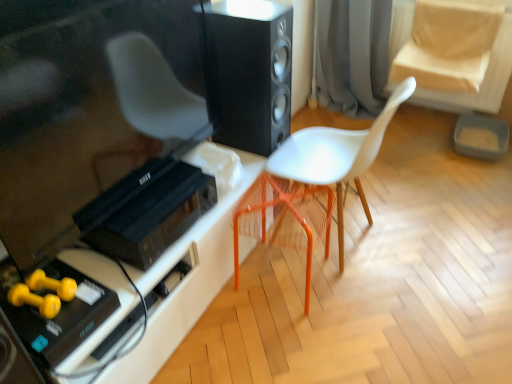
In order to click on free point in front of orange plastic swivel chair at center in this screenshot , I will do coord(290,339).